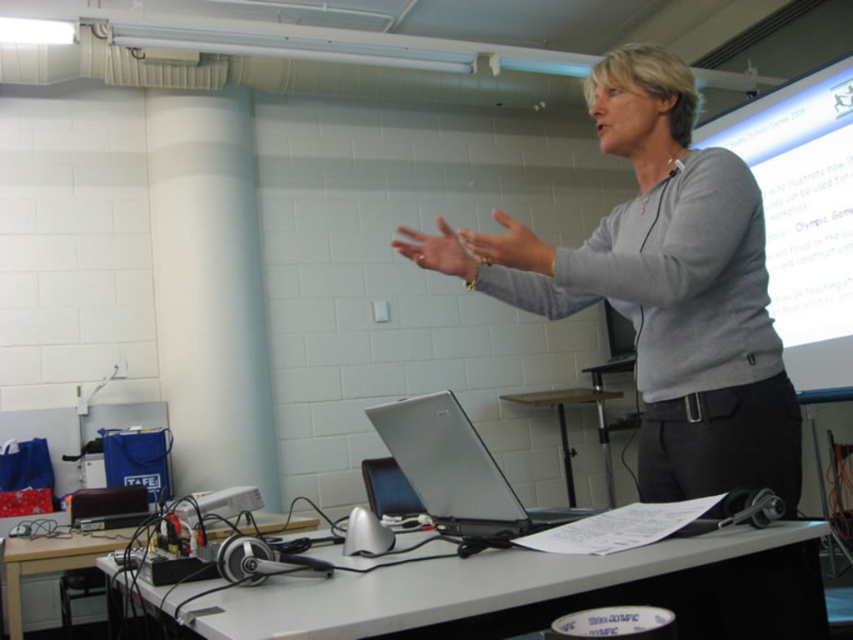
Question: Which point is closer to the camera?

Choices:
 (A) white plastic table at center
 (B) wooden table at center

Answer: (A)

Question: Which point is farther to the camera?

Choices:
 (A) white glossy projection screen at upper right
 (B) gray matte sweater at center

Answer: (A)

Question: Can you confirm if gray matte sweater at center is positioned above white plastic table at center?

Choices:
 (A) no
 (B) yes

Answer: (B)

Question: In this image, where is gray matte sweater at center located relative to silver metallic laptop at center?

Choices:
 (A) above
 (B) below

Answer: (A)

Question: Is gray matte sweater at center to the left of black plastic headphones at lower left from the viewer's perspective?

Choices:
 (A) yes
 (B) no

Answer: (B)

Question: Which object is positioned farthest from the silver metallic laptop at center?

Choices:
 (A) gray matte sweater at center
 (B) black plastic headphones at lower left

Answer: (B)